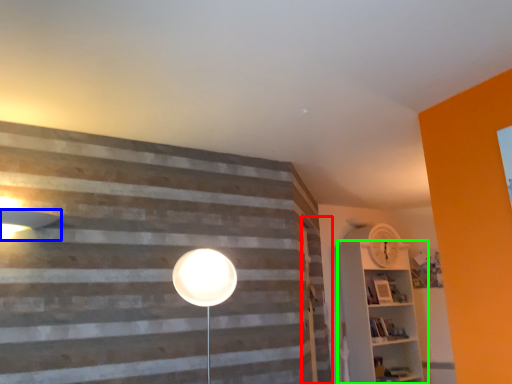
Question: Which object is the closest to the barn door (highlighted by a red box)? Choose among these: lamp (highlighted by a blue box) or shelf (highlighted by a green box).

Choices:
 (A) lamp
 (B) shelf

Answer: (B)